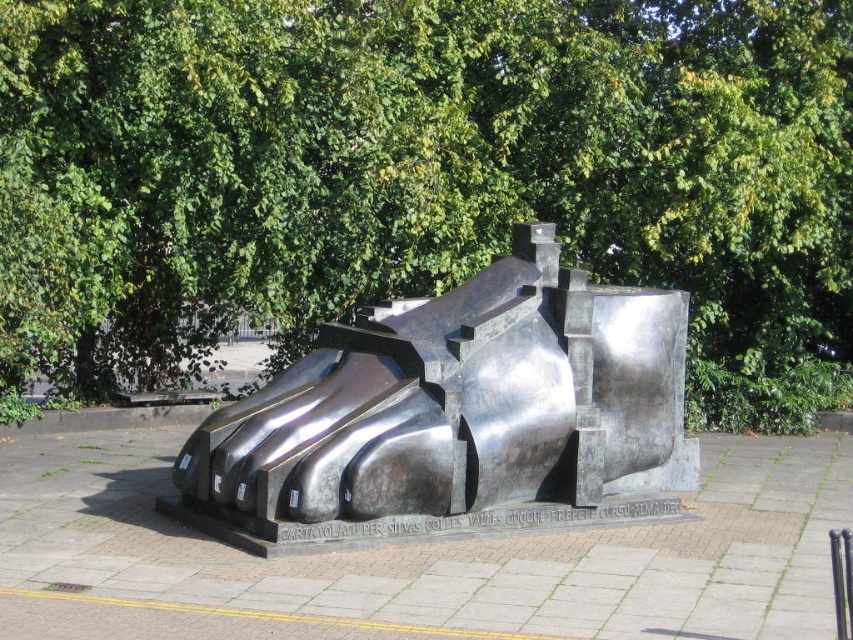
Does green leafy tree at upper center have a lesser height compared to polished bronze sculpture at center?

No, green leafy tree at upper center is not shorter than polished bronze sculpture at center.

Identify the location of green leafy tree at upper center. Image resolution: width=853 pixels, height=640 pixels. (421, 177).

Which is behind, point (564, 204) or point (538, 259)?

Positioned behind is point (564, 204).

In order to click on green leafy tree at upper center in this screenshot , I will do `click(421, 177)`.